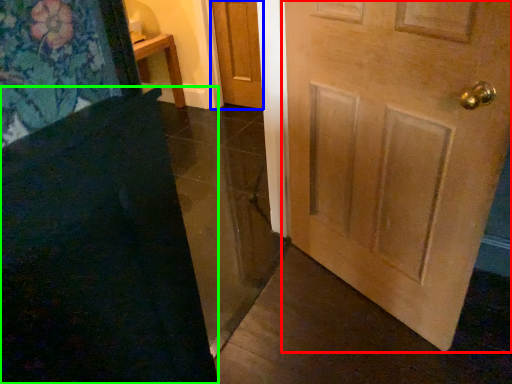
Question: Estimate the real-world distances between objects in this image. Which object is closer to door (highlighted by a red box), door (highlighted by a blue box) or doormat (highlighted by a green box)?

Choices:
 (A) door
 (B) doormat

Answer: (B)